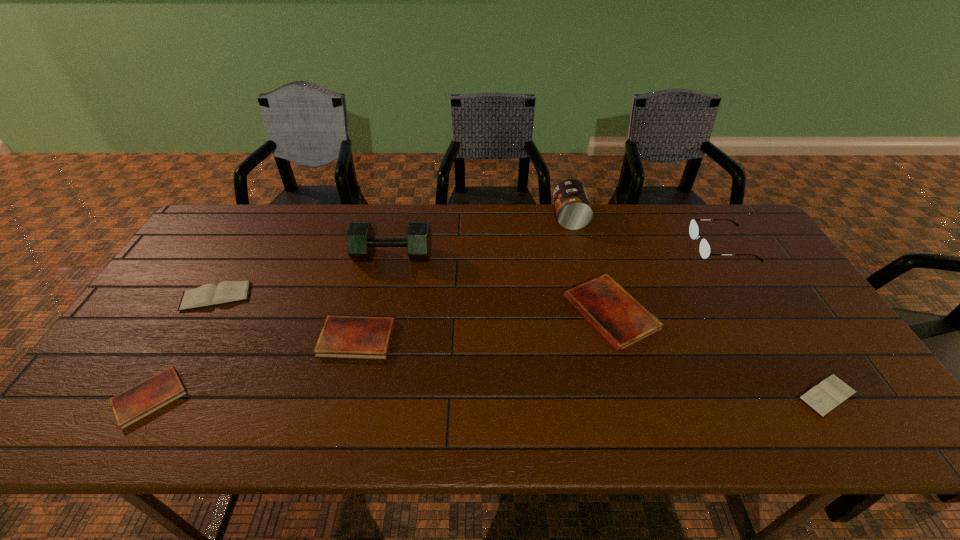
The width and height of the screenshot is (960, 540). Find the location of `the right brown diary`. the right brown diary is located at coordinates (830, 393).

The height and width of the screenshot is (540, 960). I want to click on the smaller brown diary, so click(x=830, y=393).

Locate an element on the screen. the nearest red diary is located at coordinates [x=141, y=400].

Find the location of a particular element. The image size is (960, 540). the smallest red diary is located at coordinates (141, 400).

The width and height of the screenshot is (960, 540). Find the location of `free space located on the front label of the can`. free space located on the front label of the can is located at coordinates (454, 217).

At what (x,y) coordinates should I click in order to perform the action: click on free location located 0.290m on the front label of the can. Please return your answer as a coordinate pair (x, y). Looking at the image, I should click on point(468,217).

Find the location of a particular element. free point located on the front label of the can is located at coordinates (472, 217).

Identify the location of free space located 0.220m on the back of the dumbbell. (404, 204).

Identify the location of vacant space situated 0.090m on the lenses of the black spectacles. The height and width of the screenshot is (540, 960). [x=666, y=246].

Locate an element on the screen. Image resolution: width=960 pixels, height=540 pixels. vacant space located 0.090m on the lenses of the black spectacles is located at coordinates (666, 246).